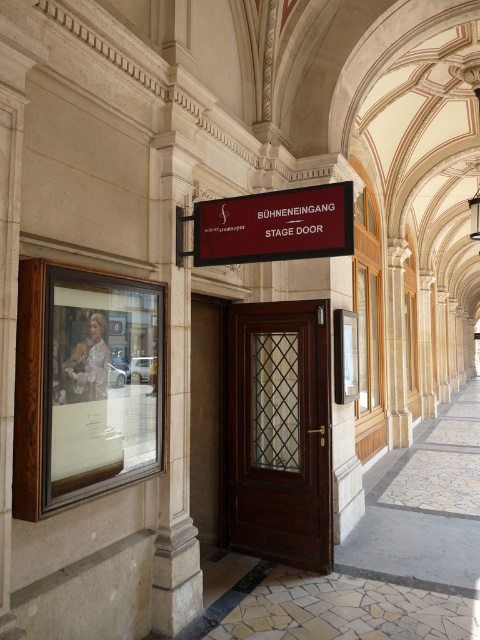
Question: Is dark wood door at center to the left of matte black sign at center from the viewer's perspective?

Choices:
 (A) no
 (B) yes

Answer: (A)

Question: Is dark wood door at center further to the viewer compared to matte black sign at center?

Choices:
 (A) yes
 (B) no

Answer: (A)

Question: Which object appears farthest from the camera in this image?

Choices:
 (A) matte black sign at center
 (B) dark wood door at center

Answer: (B)

Question: Which point is closer to the camera?

Choices:
 (A) (259, 225)
 (B) (255, 465)

Answer: (A)

Question: Is dark wood door at center further to the viewer compared to matte black sign at center?

Choices:
 (A) no
 (B) yes

Answer: (B)